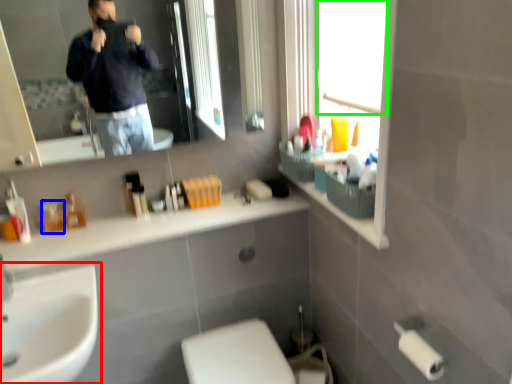
Question: Which is nearer to the sink (highlighted by a red box)? toiletry (highlighted by a blue box) or window screen (highlighted by a green box).

Choices:
 (A) toiletry
 (B) window screen

Answer: (A)